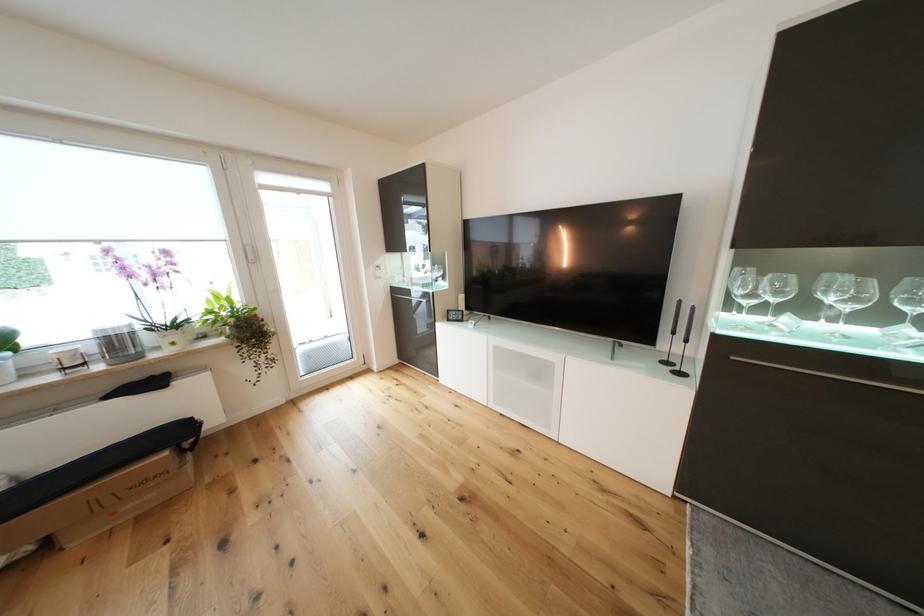
Find the location of `white door handle`. white door handle is located at coordinates (274, 294).